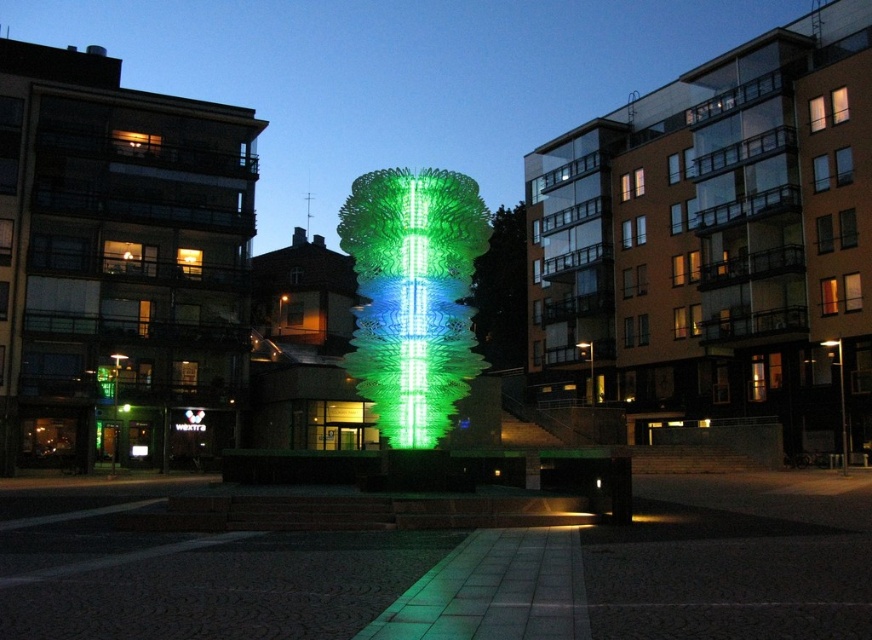
Question: Which point is farther to the camera?

Choices:
 (A) (423, 358)
 (B) (502, 276)

Answer: (B)

Question: Which point is closer to the camera taking this photo?

Choices:
 (A) coord(366,188)
 (B) coord(480,305)

Answer: (A)

Question: Is green translucent sculpture at center below green textured tree at center?

Choices:
 (A) yes
 (B) no

Answer: (A)

Question: Is green translucent sculpture at center thinner than green textured tree at center?

Choices:
 (A) no
 (B) yes

Answer: (B)

Question: Which point is closer to the camera?

Choices:
 (A) green textured tree at center
 (B) green translucent sculpture at center

Answer: (B)

Question: Is green translucent sculpture at center below green textured tree at center?

Choices:
 (A) no
 (B) yes

Answer: (B)